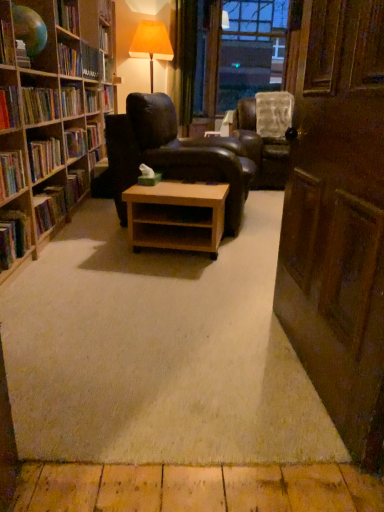
Question: Based on their sizes in the image, would you say hardcover book at left, which is the fourth book in front-to-back order, is bigger or smaller than transparent plastic window screen at upper center?

Choices:
 (A) big
 (B) small

Answer: (B)

Question: From a real-world perspective, is hardcover book at left, acting as the 3th book starting from the back, physically located above or below transparent plastic window screen at upper center?

Choices:
 (A) above
 (B) below

Answer: (B)

Question: Which object is positioned closest to the wooden door at right?

Choices:
 (A) hardcover book at left, the sixth book from the top
 (B) wooden bookshelf at left
 (C) transparent plastic window screen at upper center
 (D) leather armchair at center, which ranks as the 1th chair in front-to-back order
 (E) hardcover book at left, the third book from the top

Answer: (A)

Question: Which object is the closest to the hardcover book at left, which is counted as the 3th book, starting from the front?

Choices:
 (A) hardcover book at upper left, positioned as the second book in top-to-bottom order
 (B) transparent plastic window screen at upper center
 (C) matte black globe at upper left
 (D) leather armchair at center, which ranks as the 1th chair in front-to-back order
 (E) light brown wood at center

Answer: (C)